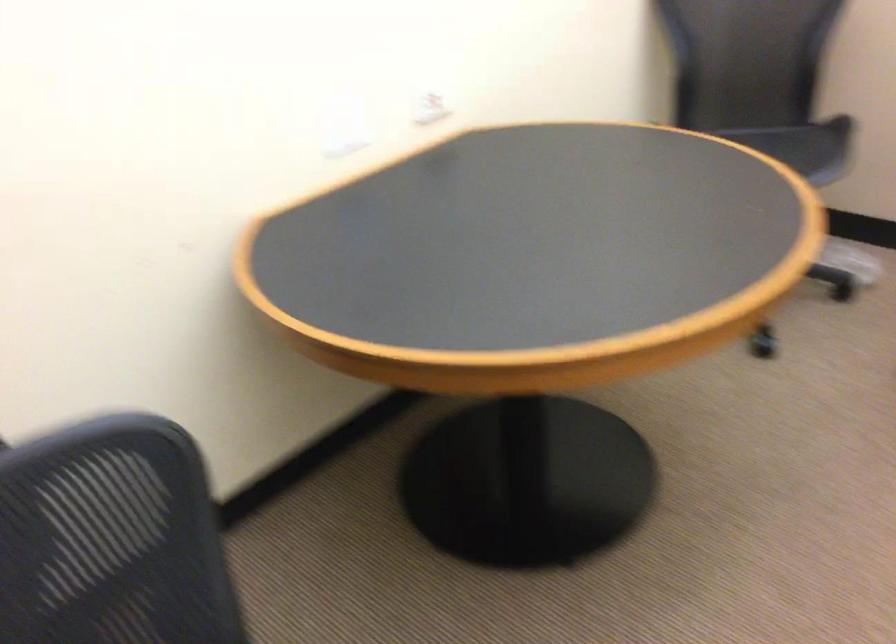
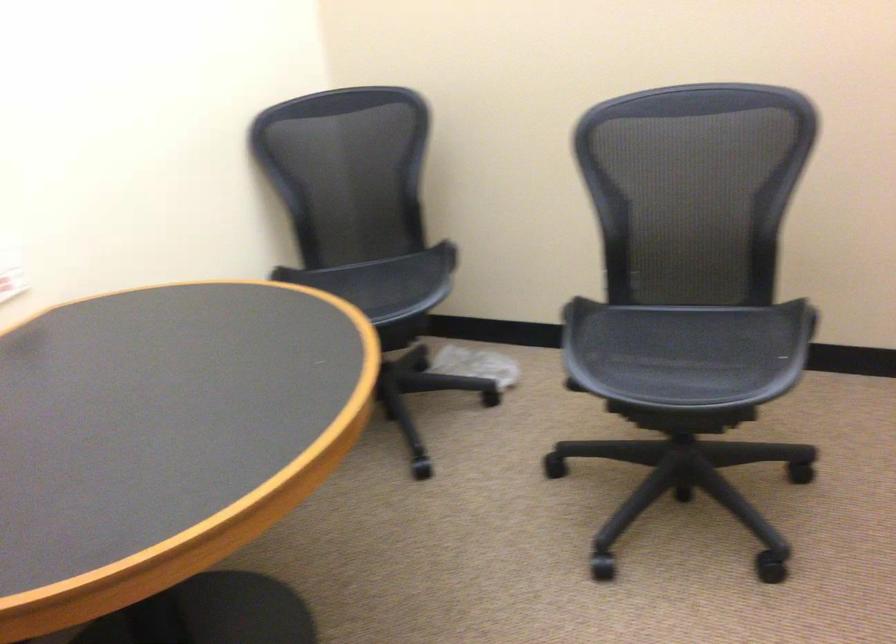
Question: What movement of the cameraman would produce the second image?

Choices:
 (A) Left
 (B) Right
 (C) Forward
 (D) Backward

Answer: (B)